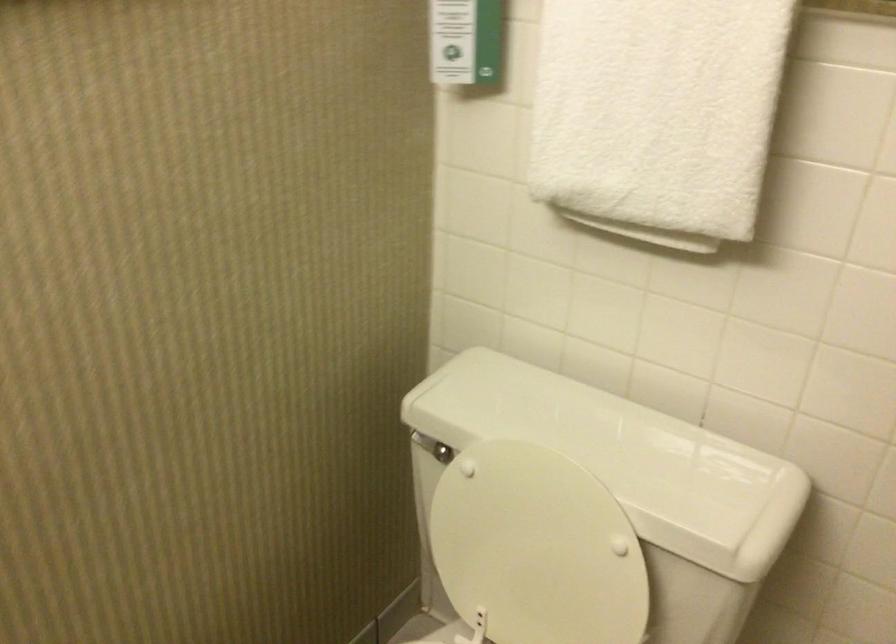
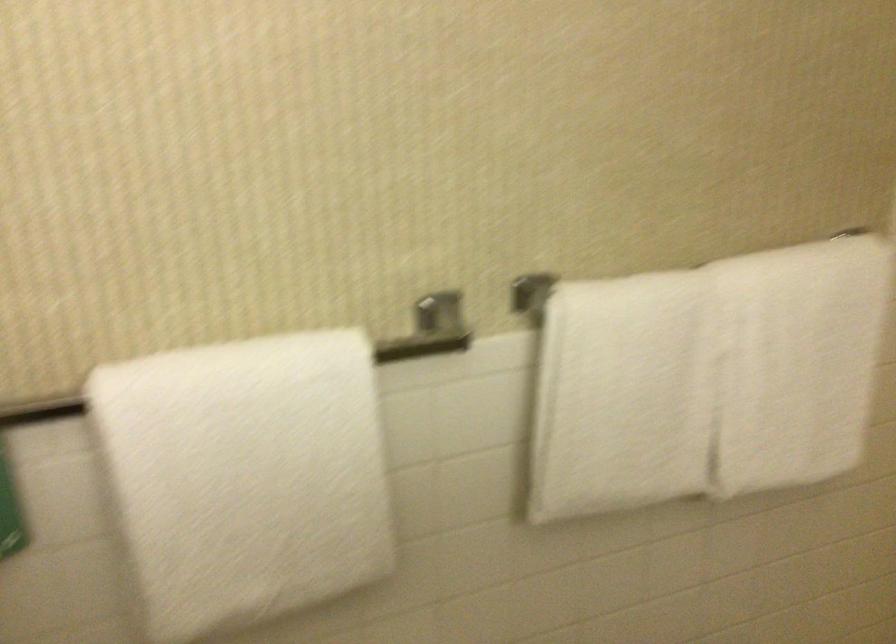
Question: The first image is from the beginning of the video and the second image is from the end. How did the camera likely rotate when shooting the video?

Choices:
 (A) Left
 (B) Right
 (C) Up
 (D) Down

Answer: (B)